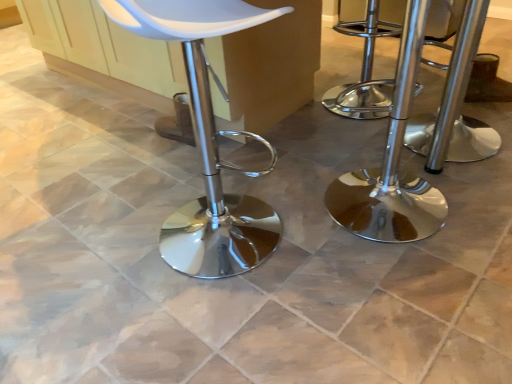
The width and height of the screenshot is (512, 384). Identify the location of free region on the left part of white matte stool at center. (100, 247).